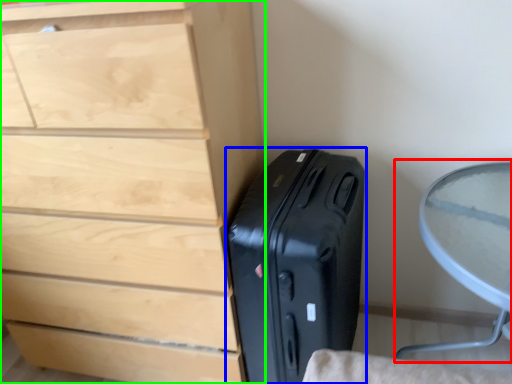
Question: Which object is the farthest from round table (highlighted by a red box)? Choose among these: suitcase (highlighted by a blue box) or chest of drawers (highlighted by a green box).

Choices:
 (A) suitcase
 (B) chest of drawers

Answer: (B)